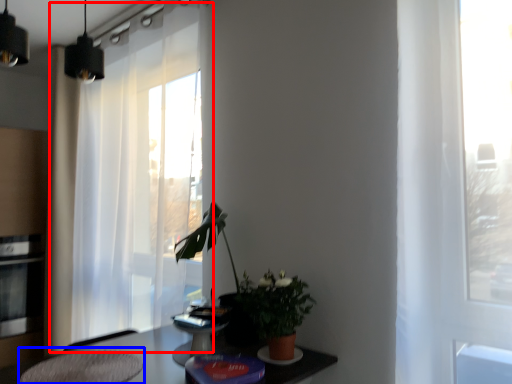
Question: Which of the following is the closest to the observer, curtain (highlighted by a red box) or swivel chair (highlighted by a blue box)?

Choices:
 (A) curtain
 (B) swivel chair

Answer: (B)